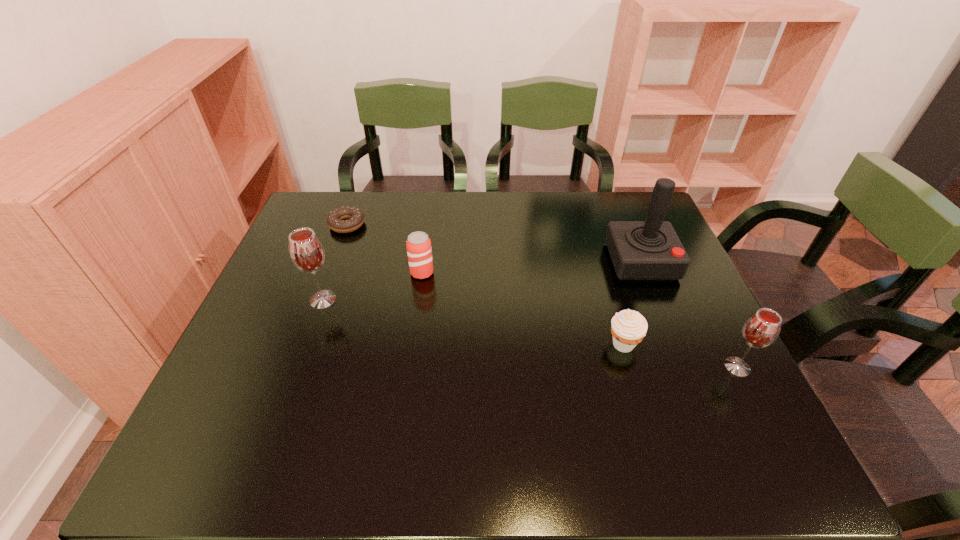
At what (x,y) coordinates should I click in order to perform the action: click on free space located on the back of the shorter wineglass. Please return your answer as a coordinate pair (x, y). This screenshot has height=540, width=960. Looking at the image, I should click on (679, 252).

Find the location of a particular element. The height and width of the screenshot is (540, 960). free space located 0.060m on the base of the tallest object is located at coordinates (657, 299).

Find the location of a particular element. The image size is (960, 540). vacant space located on the front of the farthest object is located at coordinates (332, 266).

Where is `free space located 0.280m on the back of the third object from left to right`? The width and height of the screenshot is (960, 540). free space located 0.280m on the back of the third object from left to right is located at coordinates (431, 208).

You are a GUI agent. You are given a task and a screenshot of the screen. Output one action in this format:
    pyautogui.click(x=<x>, y=<y>)
    Task: Click on the vacant space located 0.070m on the left of the muffin
    The image size is (960, 540).
    Given the screenshot: What is the action you would take?
    pyautogui.click(x=576, y=344)

You are a GUI agent. You are given a task and a screenshot of the screen. Output one action in this format:
    pyautogui.click(x=<x>, y=<y>)
    Task: Click on the object at the far edge
    The height and width of the screenshot is (540, 960).
    Given the screenshot: What is the action you would take?
    pyautogui.click(x=335, y=220)

Find the location of `wineglass that is at the left edge`. wineglass that is at the left edge is located at coordinates (306, 251).

The width and height of the screenshot is (960, 540). I want to click on doughnut present at the left edge, so click(335, 220).

The image size is (960, 540). Identify the location of wineglass situated at the right edge. (762, 328).

Find the location of a particular element. This screenshot has width=960, height=540. joystick at the right edge is located at coordinates (640, 250).